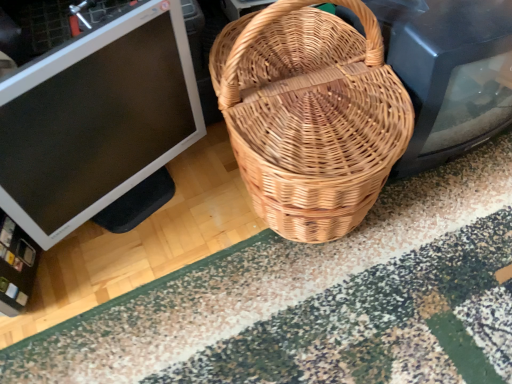
Where is `empty space that is in between matte black monitor at left and natural woven picnic basket at center`? empty space that is in between matte black monitor at left and natural woven picnic basket at center is located at coordinates (185, 244).